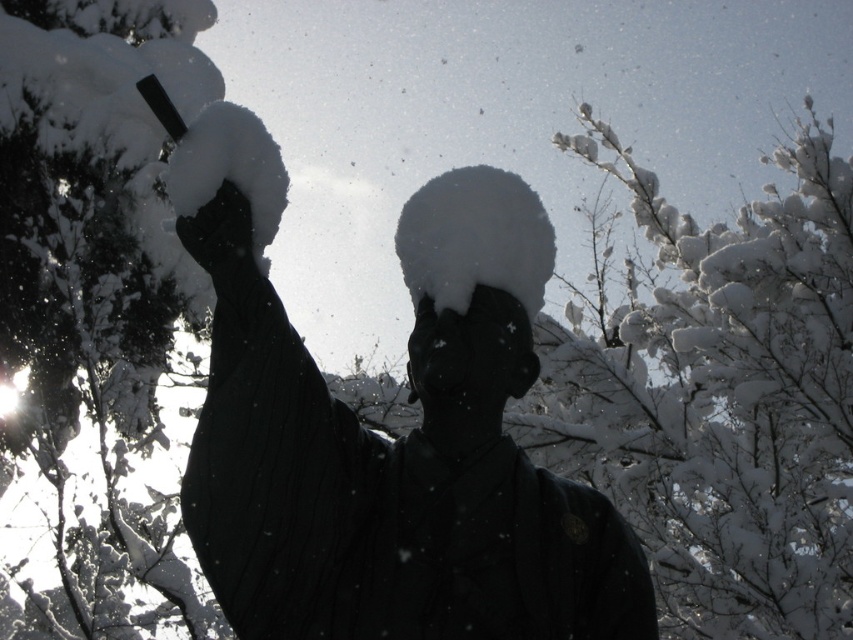
You are a photographer trying to capture the statue and the snowy branches at upper right in the same frame. Given that your camera has a maximum focus range of 10 meters, will you be able to get both subjects in focus?

The snowy branches at upper right are 10.37 meters away from the camera, which exceeds the camera maximum focus range of 10 meters. Therefore, you won not be able to capture both subjects in focus.

You are a photographer trying to capture the statue and its surroundings. The snowy branches at upper right are blocking part of the statue. To get a clear view of the statue, should you move left or right?

Since the snowy branches at upper right are located at point (717, 394), which is on the right side of the image, moving to the left would help you avoid the obstruction caused by the snowy branches at upper right and get a clearer view of the statue.